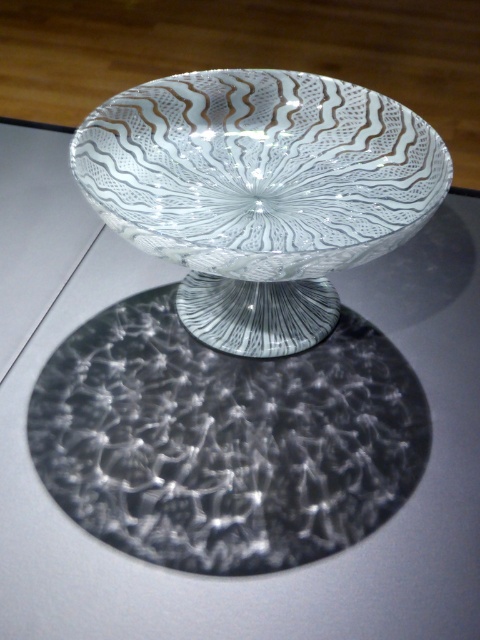
You are standing 1 meter away from the decorative glass bowl. If you move forward 0.2 meters, will the point at coordinates point (118, 317) become closer to you?

The distance of point (118, 317) from viewer is 1.19 meters. Moving forward 0.2 meters from your current position 1 meter away would bring you to 1.2 meters away from the bowl. Since 1.2 meters is farther than 1.19 meters, the point would actually be farther away from you.

You are standing 1 meter away from the transparent textured glass plate at center. Can you reach it without moving your feet?

The transparent textured glass plate at center is 88.78 centimeters away from the viewer. Since you are standing 1 meter away, which is 100 centimeters, you are slightly farther than the plate. However, most people can comfortably reach about 80 to 90 centimeters without moving their feet. Therefore, you might be able to reach it, but it could be a bit of a stretch depending on your arm length.

You are a delivery person who just arrived at a modern art gallery. You need to place a small package on the table where the decorative glass bowl is located. The package must be placed precisely at the point with coordinates (226, 440). However, there is an object at that exact point. What is the object located at that coordinate?

The object located at point (226, 440) is a transparent textured glass plate at center.